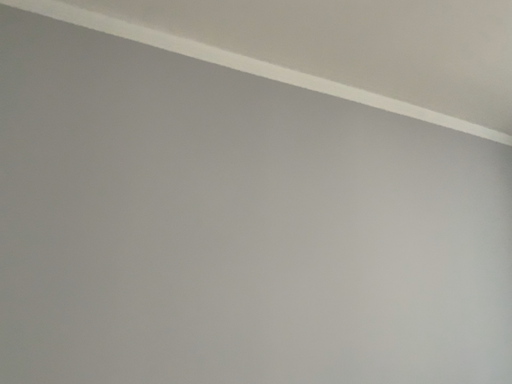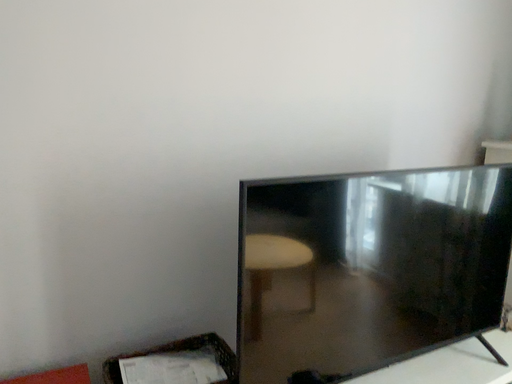
Question: Which way did the camera rotate in the video?

Choices:
 (A) rotated upward
 (B) rotated downward

Answer: (B)